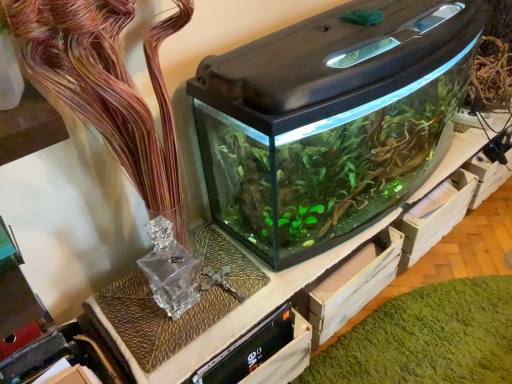
Describe the element at coordinates (426, 338) in the screenshot. I see `green matte algae at center` at that location.

I want to click on transparent glass aquarium at center, so click(x=330, y=121).

Which object is positioned more to the right, translucent glass vase at upper center or transparent glass aquarium at center?

From the viewer's perspective, transparent glass aquarium at center appears more on the right side.

The width and height of the screenshot is (512, 384). I want to click on home appliance that is behind the translucent glass vase at upper center, so click(x=330, y=121).

What's the angular difference between translucent glass vase at upper center and transparent glass aquarium at center's facing directions?

There is a 3.73-degree angle between the facing directions of translucent glass vase at upper center and transparent glass aquarium at center.

Does point (51, 83) appear closer or farther from the camera than point (353, 97)?

Point (51, 83) is closer to the camera than point (353, 97).

From the image's perspective, which is above, translucent glass vase at upper center or green matte algae at center?

From the image's view, translucent glass vase at upper center is above.

How many degrees apart are the facing directions of translucent glass vase at upper center and green matte algae at center?

87.4 degrees.

Is green matte algae at center at the back of translucent glass vase at upper center?

No.

Is there a large distance between green matte algae at center and transparent glass aquarium at center?

green matte algae at center is near transparent glass aquarium at center, not far away.

Find the location of `algae below the transparent glass aquarium at center (from the image's perspective)`. algae below the transparent glass aquarium at center (from the image's perspective) is located at coordinates (426, 338).

Could you tell me if green matte algae at center is turned towards transparent glass aquarium at center?

No, green matte algae at center is not aimed at transparent glass aquarium at center.

Which is further, (x=455, y=281) or (x=365, y=66)?

Positioned behind is point (x=455, y=281).

Is transparent glass aquarium at center thinner than green matte algae at center?

Yes, transparent glass aquarium at center is thinner than green matte algae at center.

Does transparent glass aquarium at center turn towards green matte algae at center?

No, transparent glass aquarium at center is not turned towards green matte algae at center.

Does point (420, 85) come behind point (447, 346)?

That is False.

This screenshot has height=384, width=512. In order to click on algae below the transparent glass aquarium at center (from the image's perspective) in this screenshot , I will do `click(426, 338)`.

Is transparent glass aquarium at center next to translucent glass vase at upper center and touching it?

There is a gap between transparent glass aquarium at center and translucent glass vase at upper center.

Locate an element on the screen. Image resolution: width=512 pixels, height=384 pixels. home appliance on the right side of translucent glass vase at upper center is located at coordinates click(x=330, y=121).

How distant is transparent glass aquarium at center from translucent glass vase at upper center?

transparent glass aquarium at center is 19.27 inches from translucent glass vase at upper center.

Considering the sizes of objects transparent glass aquarium at center and translucent glass vase at upper center in the image provided, who is taller, transparent glass aquarium at center or translucent glass vase at upper center?

With more height is translucent glass vase at upper center.

Is green matte algae at center not near translucent glass vase at upper center?

green matte algae at center is actually quite close to translucent glass vase at upper center.

Can you confirm if green matte algae at center is positioned to the left of translucent glass vase at upper center?

No, green matte algae at center is not to the left of translucent glass vase at upper center.

Does green matte algae at center have a larger size compared to translucent glass vase at upper center?

No, green matte algae at center is not bigger than translucent glass vase at upper center.

From the image's perspective, between green matte algae at center and translucent glass vase at upper center, which one is located above?

translucent glass vase at upper center.

Where is `plant located in front of the transparent glass aquarium at center`? plant located in front of the transparent glass aquarium at center is located at coordinates (106, 85).

Locate an element on the screen. plant above the green matte algae at center (from a real-world perspective) is located at coordinates (106, 85).

Based on their spatial positions, is transparent glass aquarium at center or green matte algae at center closer to translucent glass vase at upper center?

Among the two, transparent glass aquarium at center is located nearer to translucent glass vase at upper center.

Based on their spatial positions, is transparent glass aquarium at center or translucent glass vase at upper center further from green matte algae at center?

Based on the image, translucent glass vase at upper center appears to be further to green matte algae at center.

From the image, which object appears to be farther from transparent glass aquarium at center, green matte algae at center or translucent glass vase at upper center?

green matte algae at center.

When comparing their distances from translucent glass vase at upper center, does green matte algae at center or transparent glass aquarium at center seem further?

green matte algae at center lies further to translucent glass vase at upper center than the other object.

Estimate the real-world distances between objects in this image. Which object is closer to green matte algae at center, translucent glass vase at upper center or transparent glass aquarium at center?

Among the two, transparent glass aquarium at center is located nearer to green matte algae at center.

From the image, which object appears to be farther from transparent glass aquarium at center, translucent glass vase at upper center or green matte algae at center?

Among the two, green matte algae at center is located further to transparent glass aquarium at center.

Find the location of `home appliance situated between translucent glass vase at upper center and green matte algae at center from left to right`. home appliance situated between translucent glass vase at upper center and green matte algae at center from left to right is located at coordinates (330, 121).